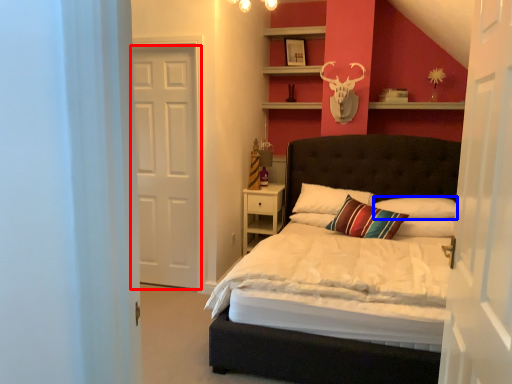
Question: Which point is closer to the camera, door (highlighted by a red box) or pillow (highlighted by a blue box)?

Choices:
 (A) door
 (B) pillow

Answer: (A)